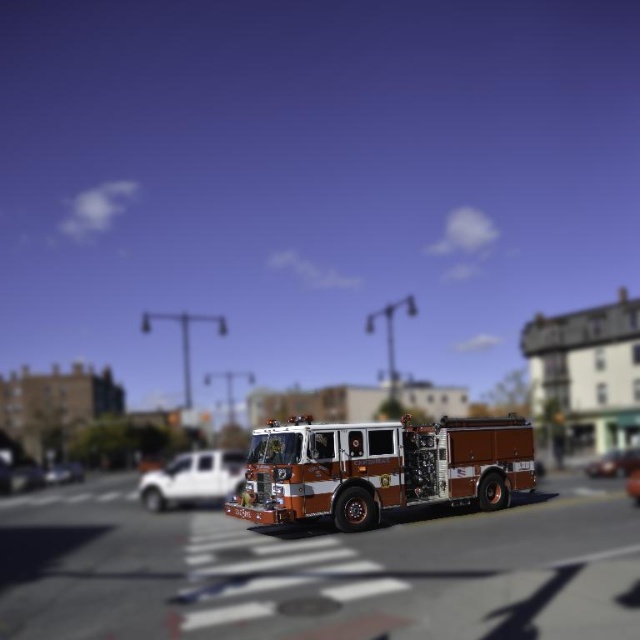
Can you confirm if shiny red fire truck at center is positioned above shiny silver car at center?

Yes, shiny red fire truck at center is above shiny silver car at center.

Can you confirm if shiny red fire truck at center is positioned below shiny silver car at center?

Incorrect, shiny red fire truck at center is not positioned below shiny silver car at center.

Who is more forward, (332,442) or (598,474)?

Point (332,442) is more forward.

You are a GUI agent. You are given a task and a screenshot of the screen. Output one action in this format:
    pyautogui.click(x=<x>, y=<y>)
    Task: Click on the shiny red fire truck at center
    
    Given the screenshot: What is the action you would take?
    pyautogui.click(x=380, y=468)

Does metallic silver car at center lie behind shiny orange car at center?

Yes, it is.

Does metallic silver car at center have a lesser width compared to shiny orange car at center?

No, metallic silver car at center is not thinner than shiny orange car at center.

Between point (83, 474) and point (636, 500), which one is positioned behind?

The point (83, 474) is more distant.

This screenshot has height=640, width=640. Identify the location of metallic silver car at center. (x=64, y=472).

Does shiny silver car at center lie in front of metallic silver car at center?

That is True.

Locate an element on the screen. This screenshot has height=640, width=640. shiny silver car at center is located at coordinates (608, 465).